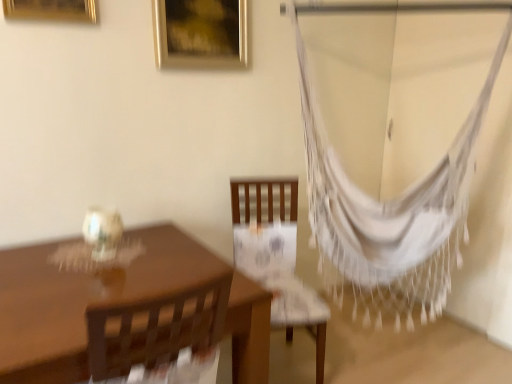
Question: Should I look upward or downward to see wooden chair at center?

Choices:
 (A) up
 (B) down

Answer: (B)

Question: Considering the relative sizes of white woven hammock at right and gold metallic picture frame at upper center, arranged as the first picture frame when viewed from the back, in the image provided, is white woven hammock at right thinner than gold metallic picture frame at upper center, arranged as the first picture frame when viewed from the back,?

Choices:
 (A) no
 (B) yes

Answer: (A)

Question: Considering the relative positions of white woven hammock at right and gold metallic picture frame at upper center, arranged as the 2th picture frame when viewed from the left, in the image provided, is white woven hammock at right to the right of gold metallic picture frame at upper center, arranged as the 2th picture frame when viewed from the left, from the viewer's perspective?

Choices:
 (A) yes
 (B) no

Answer: (A)

Question: Is white woven hammock at right positioned beyond the bounds of gold metallic picture frame at upper center, arranged as the 2th picture frame when viewed from the left?

Choices:
 (A) yes
 (B) no

Answer: (A)

Question: From a real-world perspective, is white woven hammock at right located higher than gold metallic picture frame at upper center, placed as the 2th picture frame when sorted from front to back?

Choices:
 (A) yes
 (B) no

Answer: (B)

Question: From the image's perspective, is white woven hammock at right above gold metallic picture frame at upper center, placed as the 2th picture frame when sorted from front to back?

Choices:
 (A) no
 (B) yes

Answer: (A)

Question: From the image's perspective, is white woven hammock at right under gold metallic picture frame at upper center, the 1th picture frame viewed from the right?

Choices:
 (A) yes
 (B) no

Answer: (A)

Question: From the image's perspective, is white woven hammock at right over matte brown table at left?

Choices:
 (A) no
 (B) yes

Answer: (B)

Question: Is white woven hammock at right not close to matte brown table at left?

Choices:
 (A) no
 (B) yes

Answer: (B)

Question: From the image's perspective, would you say white woven hammock at right is shown under matte brown table at left?

Choices:
 (A) no
 (B) yes

Answer: (A)

Question: Considering the relative sizes of white woven hammock at right and matte brown table at left in the image provided, is white woven hammock at right smaller than matte brown table at left?

Choices:
 (A) yes
 (B) no

Answer: (A)

Question: Is white woven hammock at right to the left of matte brown table at left from the viewer's perspective?

Choices:
 (A) no
 (B) yes

Answer: (A)

Question: Is white woven hammock at right oriented away from matte brown table at left?

Choices:
 (A) yes
 (B) no

Answer: (B)

Question: Could you tell me if gold metallic picture frame at upper center, placed as the 2th picture frame when sorted from front to back, is turned towards matte brown table at left?

Choices:
 (A) yes
 (B) no

Answer: (B)